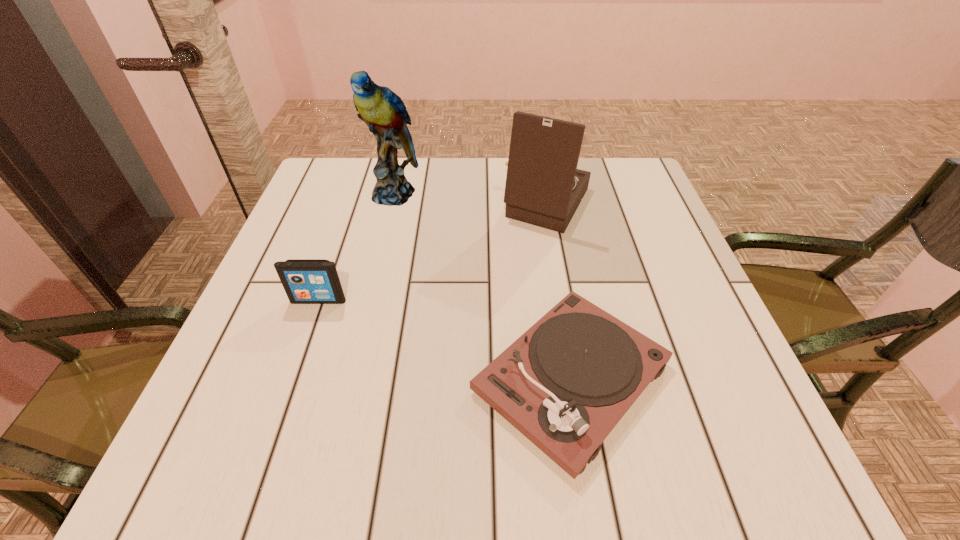
Identify the location of free area in between the parrot and the second tallest object. (470, 199).

You are a GUI agent. You are given a task and a screenshot of the screen. Output one action in this format:
    pyautogui.click(x=<x>, y=<y>)
    Task: Click on the free spot between the nearer phonograph_record and the parrot
    This screenshot has height=540, width=960.
    Given the screenshot: What is the action you would take?
    pyautogui.click(x=483, y=286)

Where is `free space between the second shortest object and the parrot`? Image resolution: width=960 pixels, height=540 pixels. free space between the second shortest object and the parrot is located at coordinates (356, 247).

Where is `free space between the parrot and the farther phonograph_record`? The height and width of the screenshot is (540, 960). free space between the parrot and the farther phonograph_record is located at coordinates (470, 199).

At what (x,y) coordinates should I click in order to perform the action: click on vacant space that is in between the shortest object and the farther phonograph_record. Please return your answer as a coordinate pair (x, y). This screenshot has width=960, height=540. Looking at the image, I should click on (559, 291).

Find the location of a particular element. Image resolution: width=960 pixels, height=540 pixels. the second closest object to the third tallest object is located at coordinates (383, 111).

At what (x,y) coordinates should I click in order to perform the action: click on object that is the third closest to the taller phonograph_record. Please return your answer as a coordinate pair (x, y). Looking at the image, I should click on (306, 281).

The image size is (960, 540). I want to click on vacant space that satisfies the following two spatial constraints: 1. on the face of the parrot; 2. on the left side of the shorter phonograph_record, so click(x=349, y=378).

At what (x,y) coordinates should I click in order to perform the action: click on free point that satisfies the following two spatial constraints: 1. on the face of the shortest object; 2. on the left side of the parrot. Please return your answer as a coordinate pair (x, y). The image size is (960, 540). Looking at the image, I should click on pyautogui.click(x=349, y=378).

This screenshot has height=540, width=960. Find the location of `vacant region that satisfies the following two spatial constraints: 1. on the front screen of the iPod; 2. on the left side of the shortest object`. vacant region that satisfies the following two spatial constraints: 1. on the front screen of the iPod; 2. on the left side of the shortest object is located at coordinates (292, 378).